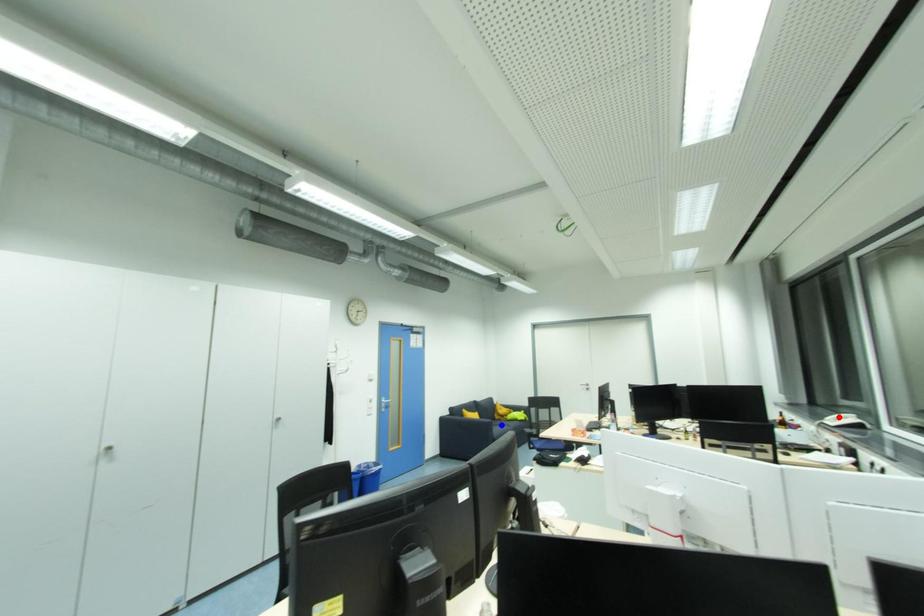
Question: Two points are marked on the image. Which point is closer to the camera?

Choices:
 (A) Blue point is closer.
 (B) Red point is closer.

Answer: (B)